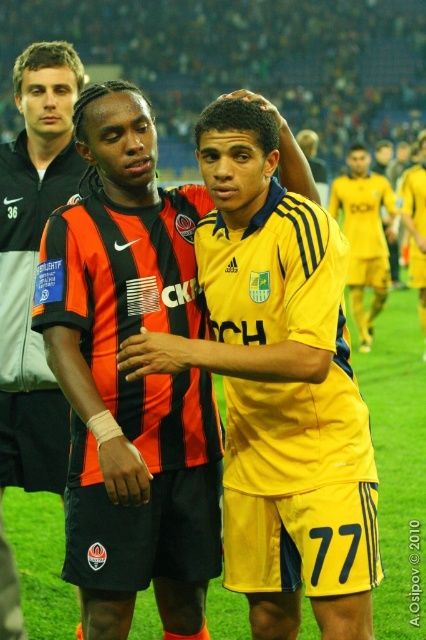
You are a soccer player trying to pass the ball to your teammate. The ball is at point [71,184] and your teammate is at point [388,216]. Since the field is uneven, you need to know which point is closer to you to decide the best passing angle. Which point is closer to you?

Point [71,184] is closer to the camera than point [388,216], so the ball is closer to you. Therefore, you should pass the ball to your teammate at point [388,216].

From the picture: You are a photographer standing behind the two players. You want to take a photo where both players are clearly visible. Which player should you focus on first to ensure the orange and black jersey at left and the yellow jersey at center are in sharp focus?

You should focus on the orange and black jersey at left first because it is closer to you. By focusing on the closer player, the yellow jersey at center will also be in focus due to the depth of field, ensuring both are sharp.

You are a soccer player standing at the point marked by coordinates point (43, 218). You need to kick a ball that is 10 feet away from you. Can you reach the ball with your current position?

The point (43, 218) is 13.79 feet away from the viewer. Since the ball is only 10 feet away from you, you can reach the ball from your current position because 10 feet is less than 13.79 feet.